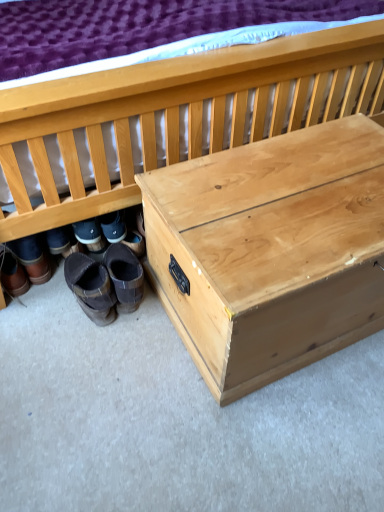
Question: Should I look upward or downward to see natural wood chest at lower right?

Choices:
 (A) down
 (B) up

Answer: (B)

Question: Is brown suede boots at lower left, which ranks as the second footwear in right-to-left order, placed right next to brown leather boots at lower left, the 4th footwear from the right?

Choices:
 (A) yes
 (B) no

Answer: (B)

Question: Is brown suede boots at lower left, which ranks as the second footwear in right-to-left order, to the left of brown leather boots at lower left, which is the first footwear in left-to-right order, from the viewer's perspective?

Choices:
 (A) yes
 (B) no

Answer: (B)

Question: Is brown suede boots at lower left, which ranks as the second footwear in right-to-left order, to the right of brown leather boots at lower left, the 4th footwear from the right, from the viewer's perspective?

Choices:
 (A) no
 (B) yes

Answer: (B)

Question: Is brown suede boots at lower left, which is counted as the third footwear, starting from the left, positioned beyond the bounds of brown leather boots at lower left, which is the first footwear in left-to-right order?

Choices:
 (A) no
 (B) yes

Answer: (B)

Question: Is brown suede boots at lower left, which ranks as the second footwear in right-to-left order, surrounding brown leather boots at lower left, the 4th footwear from the right?

Choices:
 (A) no
 (B) yes

Answer: (A)

Question: Is brown suede boots at lower left, which ranks as the second footwear in right-to-left order, closer to the viewer compared to brown leather boots at lower left, which is the first footwear in left-to-right order?

Choices:
 (A) no
 (B) yes

Answer: (B)

Question: Considering the relative sizes of brown leather boots at lower left, the 4th footwear from the right, and brown suede boots at lower left, which ranks as the second footwear in right-to-left order, in the image provided, is brown leather boots at lower left, the 4th footwear from the right, thinner than brown suede boots at lower left, which ranks as the second footwear in right-to-left order,?

Choices:
 (A) yes
 (B) no

Answer: (B)

Question: Could you tell me if brown leather boots at lower left, the 4th footwear from the right, is facing brown suede boots at lower left, which is counted as the third footwear, starting from the left?

Choices:
 (A) yes
 (B) no

Answer: (B)

Question: Can you confirm if brown leather boots at lower left, the 4th footwear from the right, is positioned to the left of brown suede boots at lower left, which is counted as the third footwear, starting from the left?

Choices:
 (A) no
 (B) yes

Answer: (B)

Question: Is brown leather boots at lower left, which is the first footwear in left-to-right order, located outside brown suede boots at lower left, which ranks as the second footwear in right-to-left order?

Choices:
 (A) yes
 (B) no

Answer: (A)

Question: Does brown leather boots at lower left, the 4th footwear from the right, have a greater width compared to brown suede boots at lower left, which ranks as the second footwear in right-to-left order?

Choices:
 (A) no
 (B) yes

Answer: (B)

Question: Is brown leather boots at lower left, which is the first footwear in left-to-right order, to the right of brown suede boots at lower left, which is counted as the third footwear, starting from the left, from the viewer's perspective?

Choices:
 (A) no
 (B) yes

Answer: (A)

Question: From the image's perspective, is natural wood chest at lower right above brown suede boots at lower left, the first footwear from the right?

Choices:
 (A) yes
 (B) no

Answer: (A)